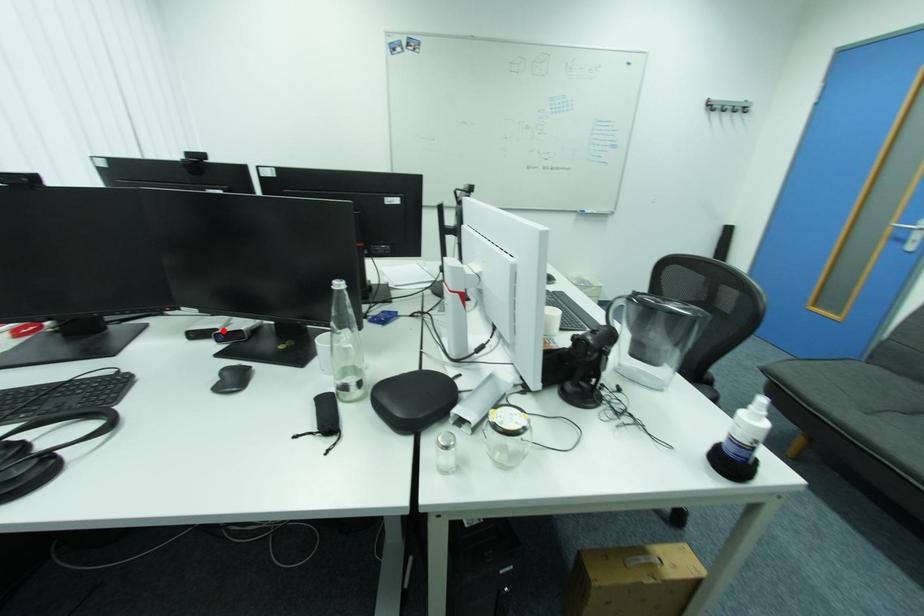
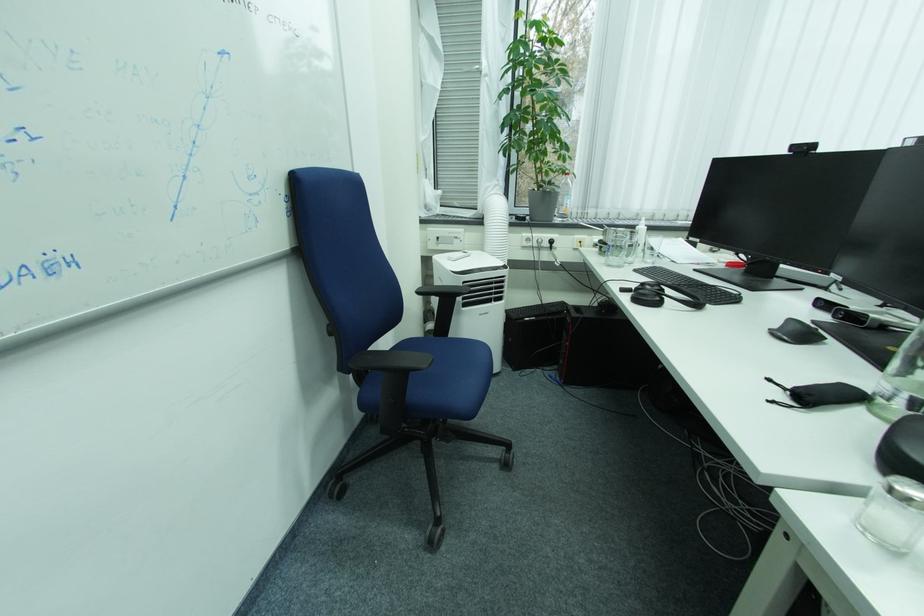
Question: I am providing you with two images of the same scene from different viewpoints. In image1, a red point is highlighted. Considering the same 3D point in image2, which of the following is correct?

Choices:
 (A) It is closer
 (B) It is farther

Answer: (B)